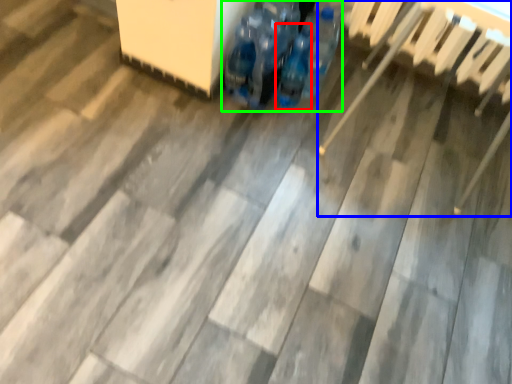
Question: Which is farther away from bottle (highlighted by a red box)? chair (highlighted by a blue box) or footwear (highlighted by a green box)?

Choices:
 (A) chair
 (B) footwear

Answer: (A)